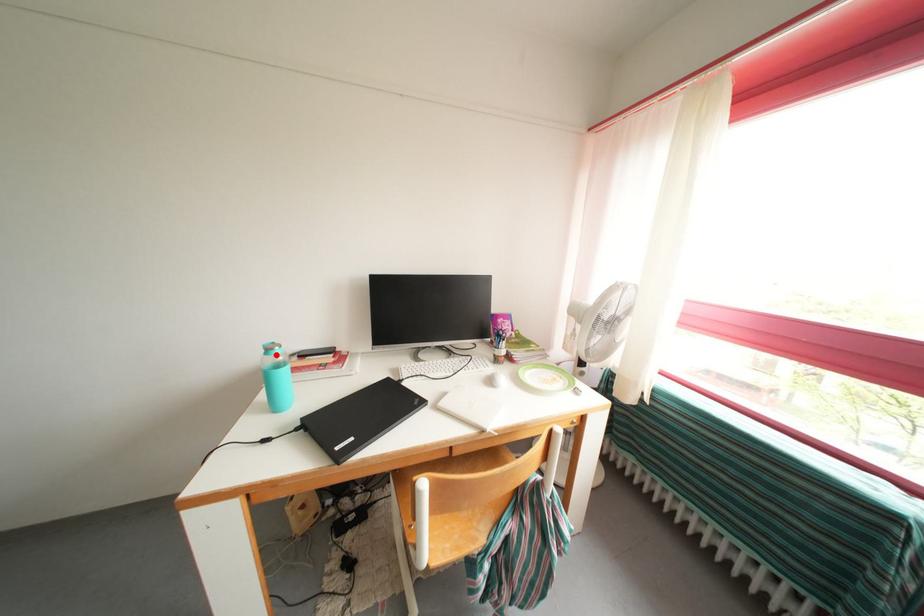
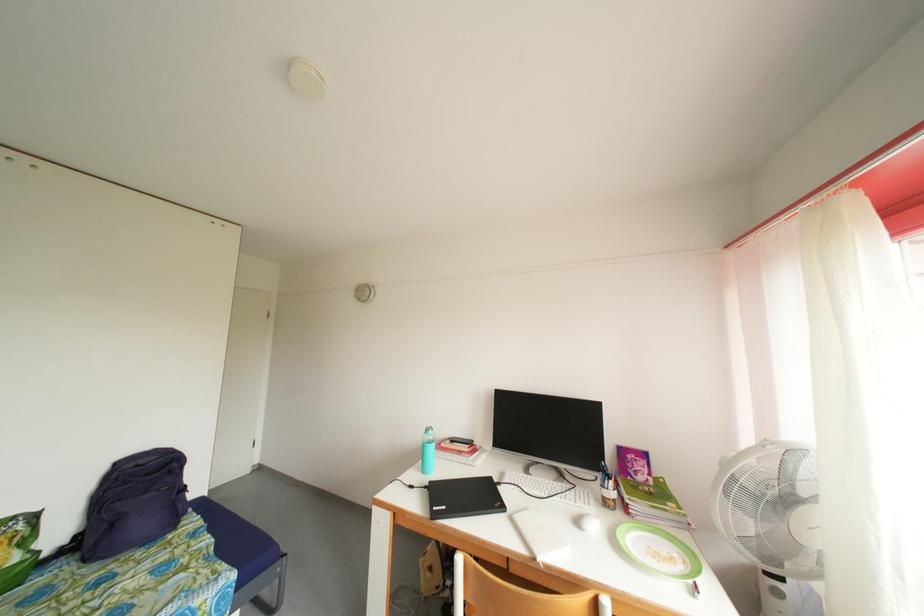
Question: I am providing you with two images of the same scene from different viewpoints. Image1 has a red point marked. In image2, the corresponding 3D location appears at what relative position? Reply with the corresponding letter.

Choices:
 (A) Closer
 (B) Farther

Answer: (B)